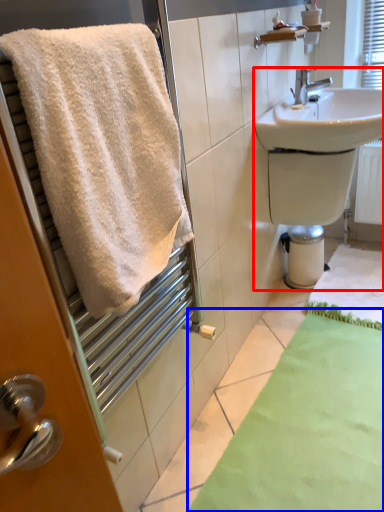
Question: Which point is further to the camera, sink (highlighted by a red box) or bath mat (highlighted by a blue box)?

Choices:
 (A) sink
 (B) bath mat

Answer: (A)